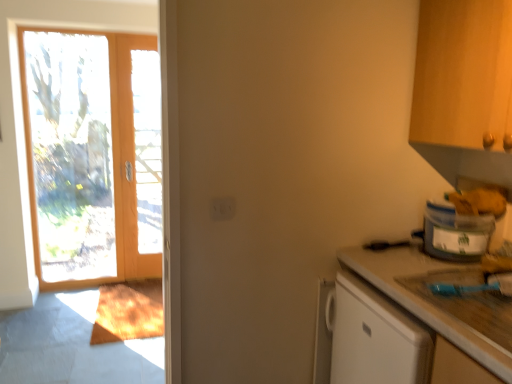
Find the location of a particular element. free space above translucent plastic container at right (from a real-world perspective) is located at coordinates (458, 207).